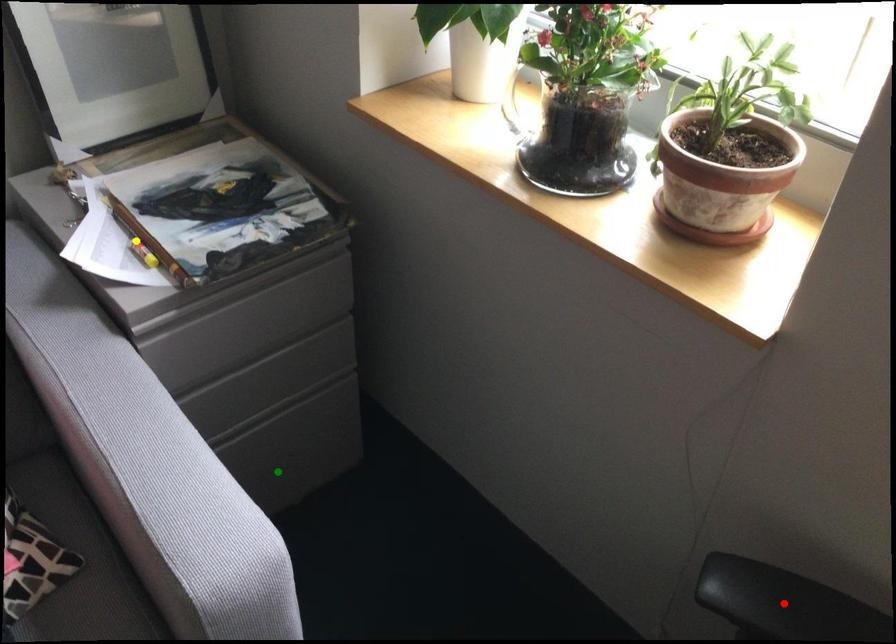
Order these from nearest to farthest:
yellow point, green point, red point

red point, yellow point, green point